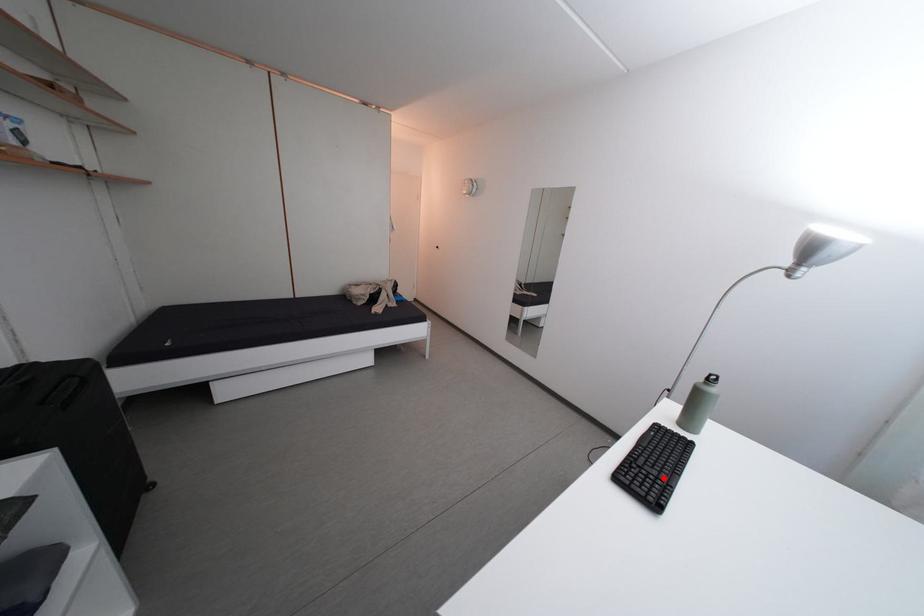
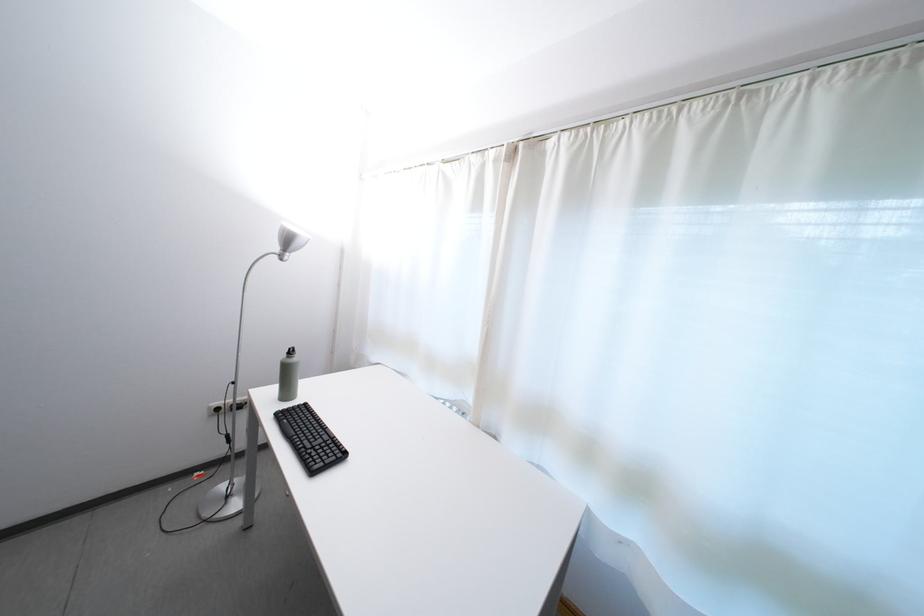
The point at the highlighted location is marked in the first image. Where is the corresponding point in the second image?

(330, 447)